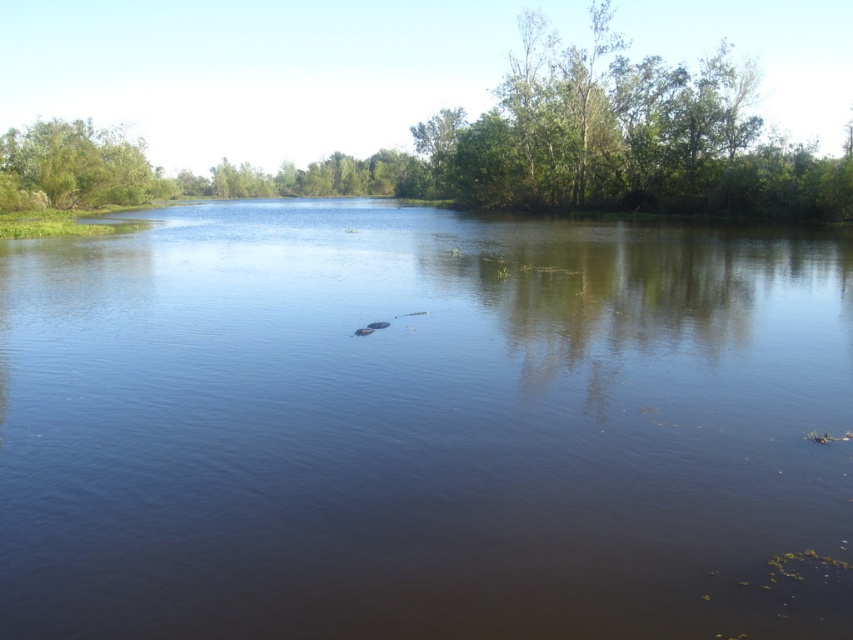
Question: Which object appears farthest from the camera in this image?

Choices:
 (A) brown murky water at center
 (B) green leafy tree at upper left

Answer: (B)

Question: Which point is farther to the camera?

Choices:
 (A) (457, 570)
 (B) (155, 186)

Answer: (B)

Question: Is brown murky water at center above green leafy trees at upper center?

Choices:
 (A) yes
 (B) no

Answer: (B)

Question: Is brown murky water at center wider than green leafy tree at upper left?

Choices:
 (A) no
 (B) yes

Answer: (B)

Question: Is brown murky water at center wider than green leafy tree at upper left?

Choices:
 (A) yes
 (B) no

Answer: (A)

Question: Which point is closer to the camera?

Choices:
 (A) (108, 442)
 (B) (277, 184)

Answer: (A)